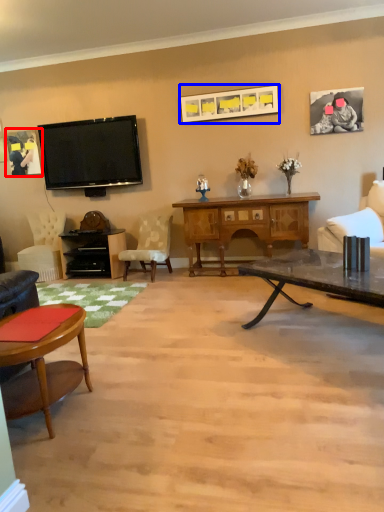
Question: Which object appears farthest to the camera in this image, picture frame (highlighted by a red box) or picture frame (highlighted by a blue box)?

Choices:
 (A) picture frame
 (B) picture frame

Answer: (A)